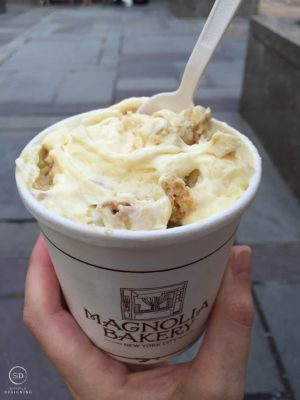
Identify the location of spoon handle. [205, 55].